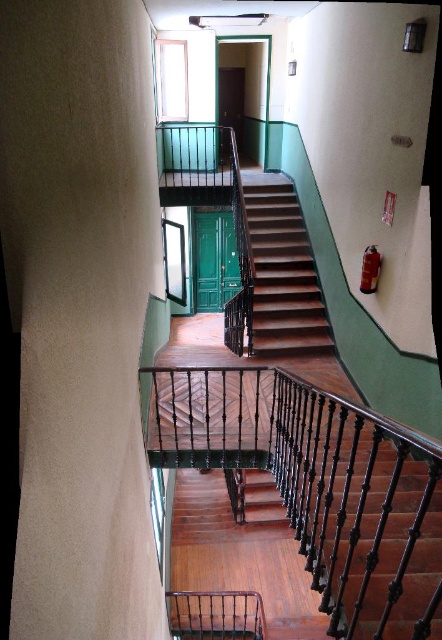
Question: In this image, where is wooden stairs at center located relative to black wrought iron balustrade at lower center?

Choices:
 (A) below
 (B) above

Answer: (B)

Question: Which object is farther from the camera taking this photo?

Choices:
 (A) wooden stairs at center
 (B) black wrought iron balustrade at lower center

Answer: (A)

Question: Is wooden stairs at center smaller than black wrought iron balustrade at lower center?

Choices:
 (A) no
 (B) yes

Answer: (A)

Question: Can you confirm if wooden stairs at center is thinner than black wrought iron balustrade at lower center?

Choices:
 (A) yes
 (B) no

Answer: (A)